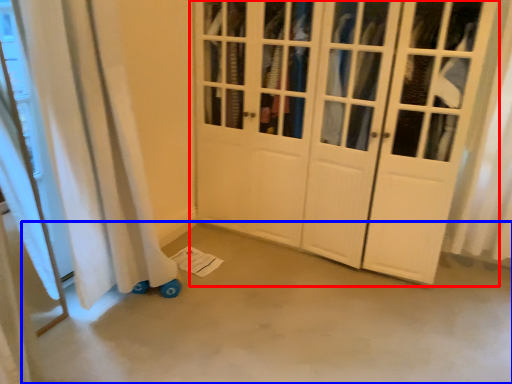
Question: Which of the following is the farthest to the observer, door (highlighted by a red box) or concrete (highlighted by a blue box)?

Choices:
 (A) door
 (B) concrete

Answer: (A)